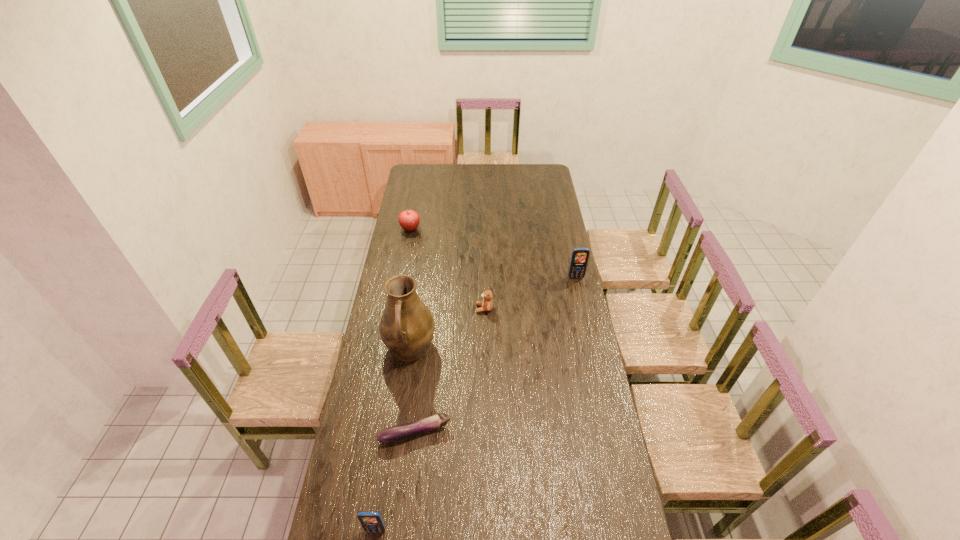
Find the location of a particular element. The width and height of the screenshot is (960, 540). free space between the shortest object and the fifth object from left to right is located at coordinates (449, 371).

You are a GUI agent. You are given a task and a screenshot of the screen. Output one action in this format:
    pyautogui.click(x=<x>, y=<y>)
    Task: Click on the blank region between the fifth nearest object and the shorter cellular telephone
    
    Given the screenshot: What is the action you would take?
    pyautogui.click(x=476, y=404)

The image size is (960, 540). I want to click on vacant area between the left cellular telephone and the second farthest object, so click(476, 404).

This screenshot has width=960, height=540. Find the location of `free space between the rightmost object and the eggplant`. free space between the rightmost object and the eggplant is located at coordinates (495, 355).

Where is `blank region between the right cellular telephone and the farthest object`? This screenshot has width=960, height=540. blank region between the right cellular telephone and the farthest object is located at coordinates tap(493, 253).

I want to click on free space that is in between the nearest object and the farthest object, so click(394, 380).

Identify the location of vacant space that's between the rightmost object and the third tallest object. Image resolution: width=960 pixels, height=540 pixels. (476, 404).

The height and width of the screenshot is (540, 960). I want to click on vacant space that is in between the pitcher and the eggplant, so click(413, 391).

At what (x,y) coordinates should I click in order to perform the action: click on free space that is in between the tallest object and the taller cellular telephone. Please return your answer as a coordinate pair (x, y). The width and height of the screenshot is (960, 540). Looking at the image, I should click on (493, 313).

Image resolution: width=960 pixels, height=540 pixels. Find the location of `object that is the fourth nearest to the taller cellular telephone`. object that is the fourth nearest to the taller cellular telephone is located at coordinates (396, 433).